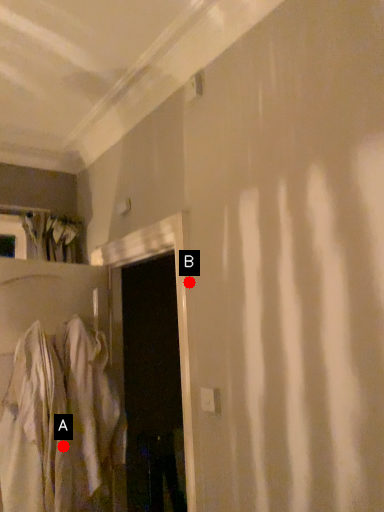
Question: Two points are circled on the image, labeled by A and B beside each circle. Which point is farther to the camera?

Choices:
 (A) A is further
 (B) B is further

Answer: (A)